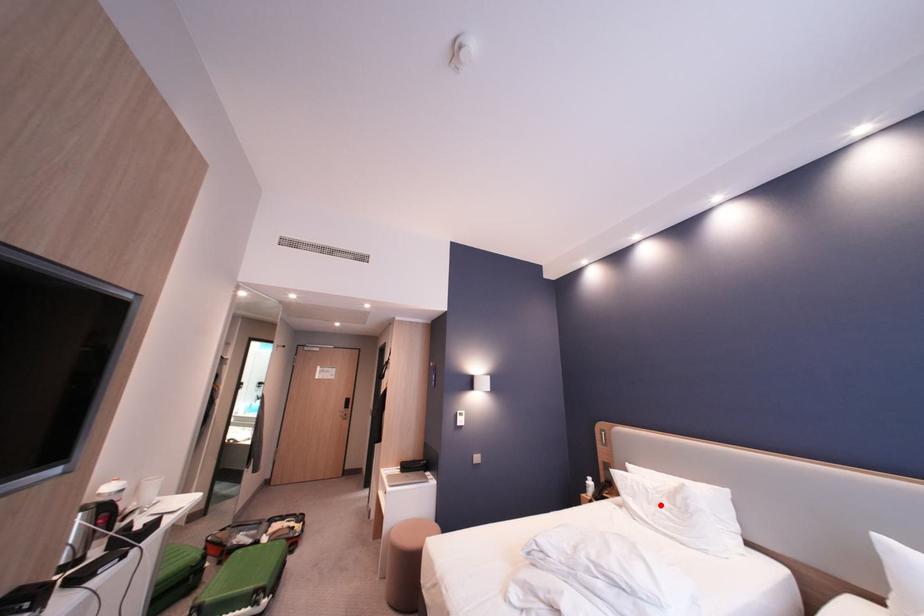
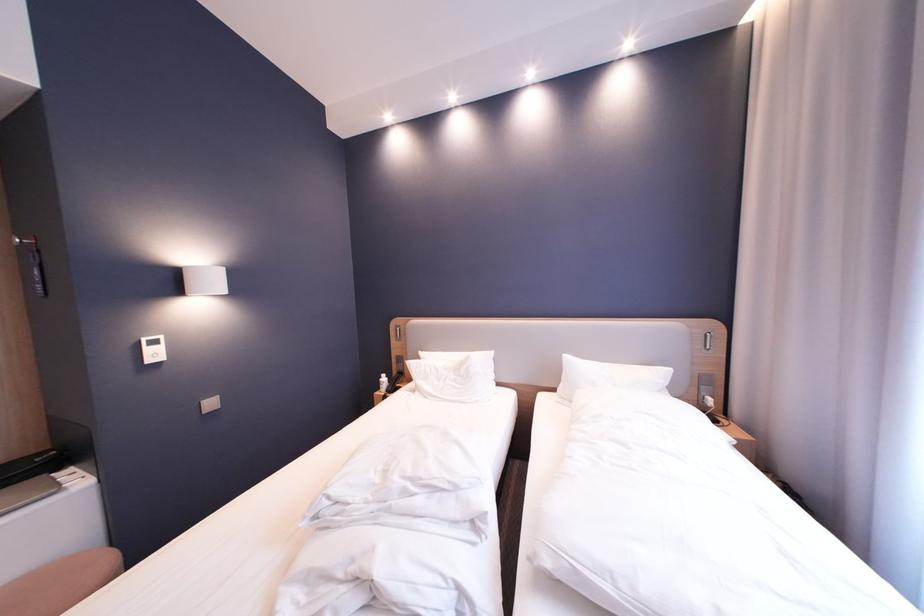
The point at the highlighted location is marked in the first image. Where is the corresponding point in the second image?

(450, 382)